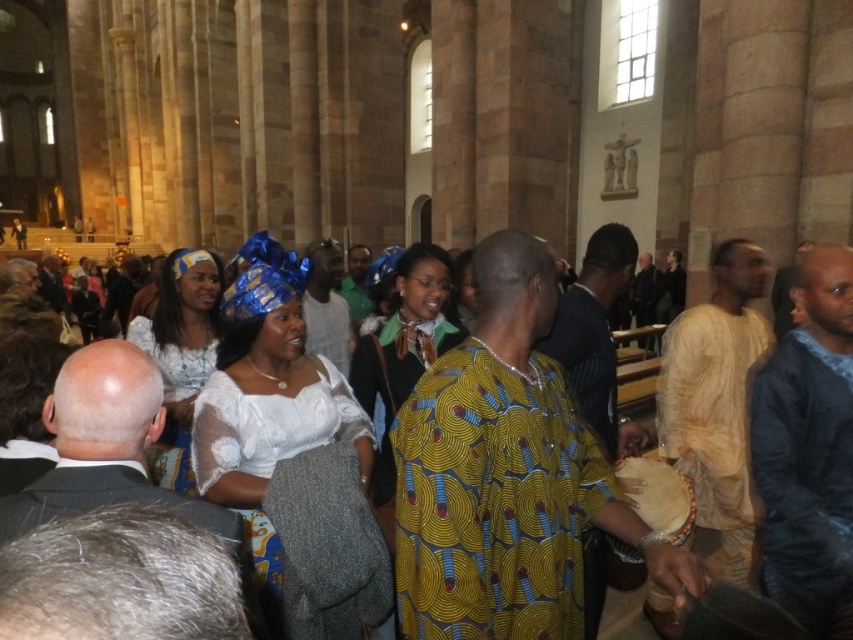
At what (x,y) coordinates should I click in order to perform the action: click on yellow printed fabric dress at center. Please return your answer as a coordinate pair (x, y). This screenshot has width=853, height=640. Looking at the image, I should click on (492, 500).

Does yellow printed fabric dress at center appear over yellow printed dress at center?

No.

Where is `yellow printed fabric dress at center`? yellow printed fabric dress at center is located at coordinates (492, 500).

Can you confirm if matte blue fabric headwrap at center is positioned above white lace dress at center?

Actually, matte blue fabric headwrap at center is below white lace dress at center.

Which is behind, point (254, 298) or point (175, 340)?

Positioned behind is point (175, 340).

Which is behind, point (335, 401) or point (183, 260)?

The point (183, 260) is behind.

Locate an element on the screen. This screenshot has height=640, width=853. matte blue fabric headwrap at center is located at coordinates (289, 452).

Looking at this image, how distant is yellow printed dress at center from white lace dress at center?

yellow printed dress at center is 8.75 meters away from white lace dress at center.

Does yellow printed dress at center have a larger size compared to white lace dress at center?

Incorrect, yellow printed dress at center is not larger than white lace dress at center.

Between point (384, 371) and point (178, 452), which one is positioned behind?

The point (384, 371) is more distant.

This screenshot has height=640, width=853. I want to click on yellow printed dress at center, so coord(403,356).